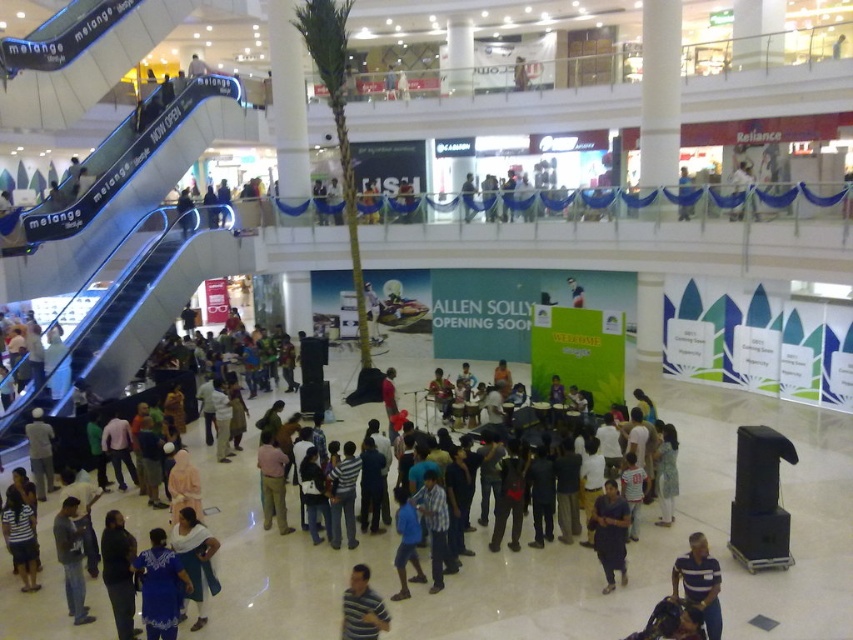
You are a customer holding a striped polo shirt at lower right and want to place it on a rack near the blue fabric umbrella at center. Can you easily move the shirt to the umbrella without moving any other items?

The striped polo shirt at lower right is in front of the blue fabric umbrella at center, so you can easily move the shirt to the umbrella without needing to move other items since it is already positioned in front.

You are a delivery robot positioned at the center of the mall. You need to deliver a package to two points marked as point (686, 552) and point (688, 196). Which point should you visit first to minimize travel distance?

You should visit point (686, 552) first because it is closer to the camera, meaning it is physically closer to your current position at the center of the mall compared to point (688, 196) which is further away.